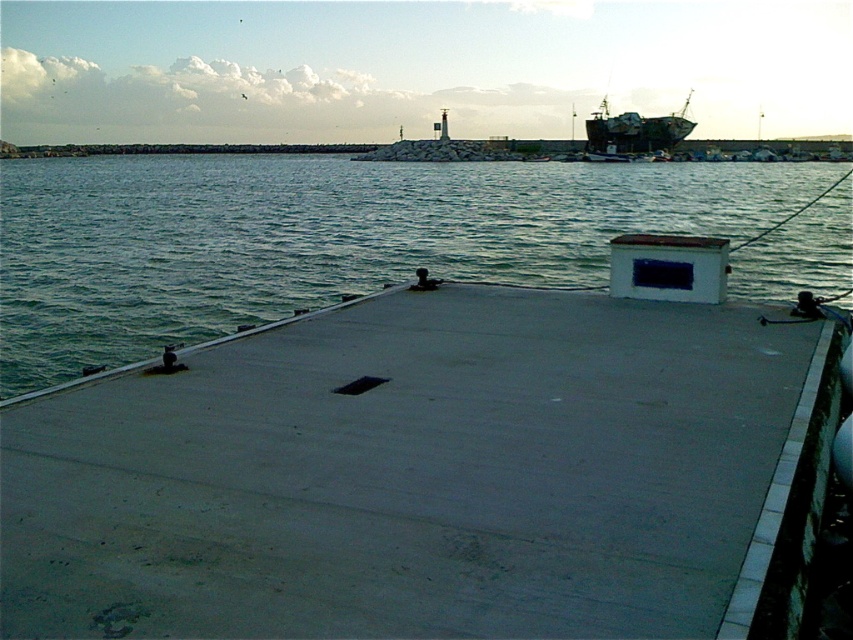
Does gray concrete dock at center have a lesser width compared to greenish water at center?

Indeed, gray concrete dock at center has a lesser width compared to greenish water at center.

Between gray concrete dock at center and greenish water at center, which one is positioned higher?

Positioned higher is greenish water at center.

Find the location of a particular element. This screenshot has height=640, width=853. gray concrete dock at center is located at coordinates (428, 468).

Image resolution: width=853 pixels, height=640 pixels. Identify the location of gray concrete dock at center. (428, 468).

Between gray concrete dock at center and metallic gray ship at upper right, which one has more height?

metallic gray ship at upper right

Find the location of a particular element. gray concrete dock at center is located at coordinates (428, 468).

Is point (251, 182) positioned before point (636, 120)?

Yes, point (251, 182) is in front of point (636, 120).

Is point (479, 173) less distant than point (688, 124)?

Yes, point (479, 173) is closer to viewer.

Identify the location of greenish water at center. Image resolution: width=853 pixels, height=640 pixels. (318, 237).